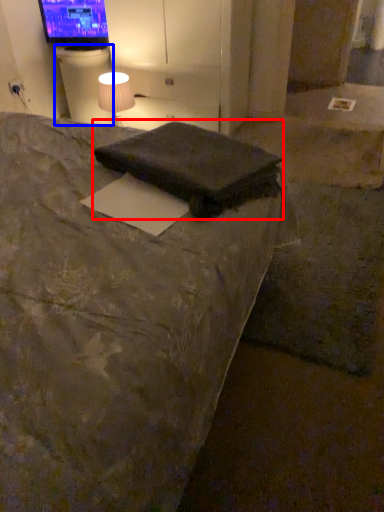
Question: Among these objects, which one is farthest to the camera, pillow (highlighted by a red box) or table (highlighted by a blue box)?

Choices:
 (A) pillow
 (B) table

Answer: (B)